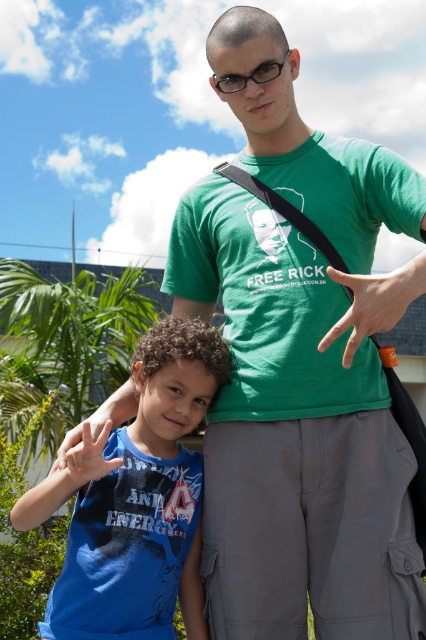
Between point (389, 292) and point (75, 445), which one is positioned behind?

The point (75, 445) is more distant.

Is orange rubber band at center further to the viewer compared to matte blue t-shirt at lower left?

Yes, it is behind matte blue t-shirt at lower left.

At what (x,y) coordinates should I click in order to perform the action: click on orange rubber band at center. Please return your answer as a coordinate pair (x, y). The width and height of the screenshot is (426, 640). Looking at the image, I should click on (374, 301).

Locate an element on the screen. This screenshot has width=426, height=640. orange rubber band at center is located at coordinates (374, 301).

Does blue cotton shirt at lower left have a larger size compared to matte blue t-shirt at lower left?

Indeed, blue cotton shirt at lower left has a larger size compared to matte blue t-shirt at lower left.

Who is shorter, blue cotton shirt at lower left or matte blue t-shirt at lower left?

matte blue t-shirt at lower left

Is point (186, 458) positioned in front of point (103, 438)?

That is False.

You are a GUI agent. You are given a task and a screenshot of the screen. Output one action in this format:
    pyautogui.click(x=<x>, y=<y>)
    Task: Click on the blue cotton shirt at lower left
    This screenshot has width=426, height=640.
    Given the screenshot: What is the action you would take?
    pyautogui.click(x=137, y=500)

Is blue cotton shirt at lower left shorter than orange rubber band at center?

Incorrect, blue cotton shirt at lower left's height does not fall short of orange rubber band at center's.

Image resolution: width=426 pixels, height=640 pixels. Find the location of `blue cotton shirt at lower left`. blue cotton shirt at lower left is located at coordinates (137, 500).